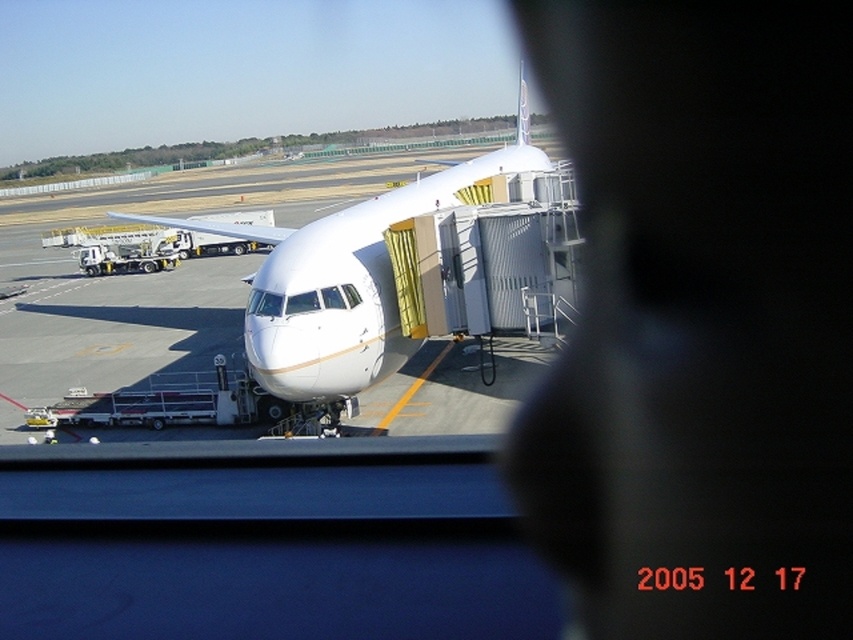
Question: Can you confirm if white glossy airplane at center is thinner than transparent glass airplane window at center?

Choices:
 (A) yes
 (B) no

Answer: (B)

Question: Can you confirm if white glossy airplane at center is bigger than transparent glass airplane window at center?

Choices:
 (A) yes
 (B) no

Answer: (A)

Question: Among these objects, which one is nearest to the camera?

Choices:
 (A) transparent glass airplane window at center
 (B) white glossy airplane at center

Answer: (B)

Question: Can you confirm if white glossy airplane at center is bigger than transparent glass airplane window at center?

Choices:
 (A) yes
 (B) no

Answer: (A)

Question: Which object appears farthest from the camera in this image?

Choices:
 (A) transparent glass airplane window at center
 (B) white glossy airplane at center

Answer: (A)

Question: Which point appears closest to the camera in this image?

Choices:
 (A) (296, 339)
 (B) (286, 307)

Answer: (A)